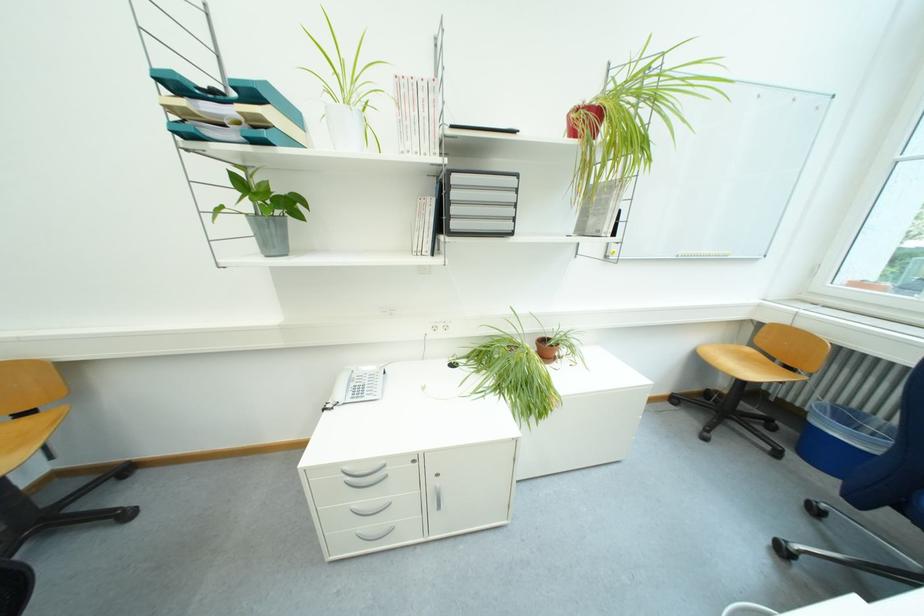
Find where to sit the wooden chair sitting surface. Please return your answer as a coordinate pair (x, y).

(745, 363)